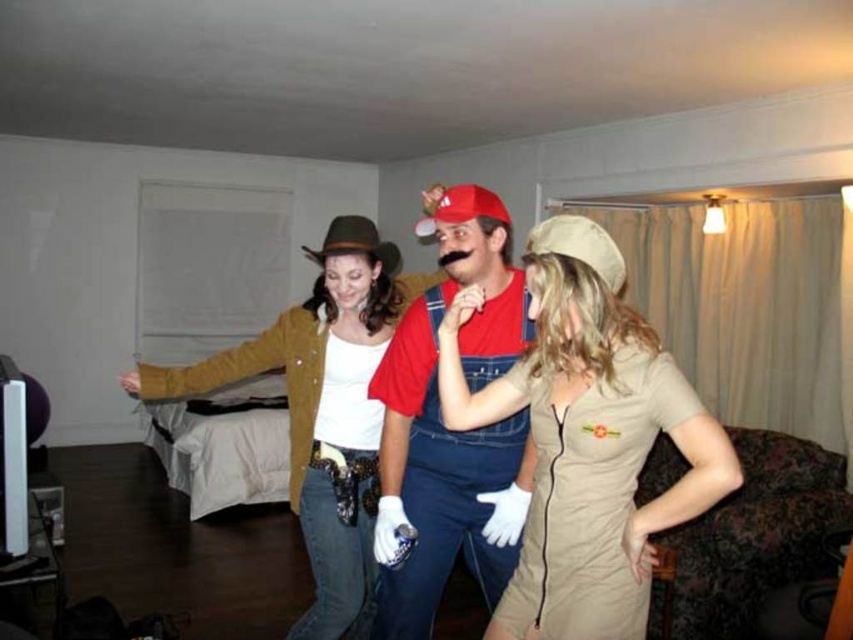
You are a photographer setting up a shoot in this room. You need to position a small light above the tan fabric dress at center and the brown felt hat at center. According to the scene description, where should you place the light to ensure it is above both objects?

The tan fabric dress at center is located above the brown felt hat at center, so placing the light above the tan fabric dress at center will also be above the brown felt hat at center.

You are an observer in the room. You see the tan fabric dress at center and the matte red shirt at center. Which one is positioned higher in the image?

The tan fabric dress at center is located above the matte red shirt at center, so it is positioned higher in the image.

You are standing at the origin of the coordinate system in the room. There is a matte red shirt at center located at point (x=450, y=429). If you move 0.1 units to the right along the x axis, will you be closer to or farther from the matte red shirt at center?

Moving 0.1 units to the right along the x axis from the origin would take you to point 0.1, 0.0. The distance between this new position and the matte red shirt at center at point (x=450, y=429) would be sqrt. Since the original distance from the origin to the shirt is sqrt, moving right along the x axis increases the distance in the y direction but reduces the x difference. However, overall, the total distance would increase because the y difference remains large. Therefore, you would be farther from the red.